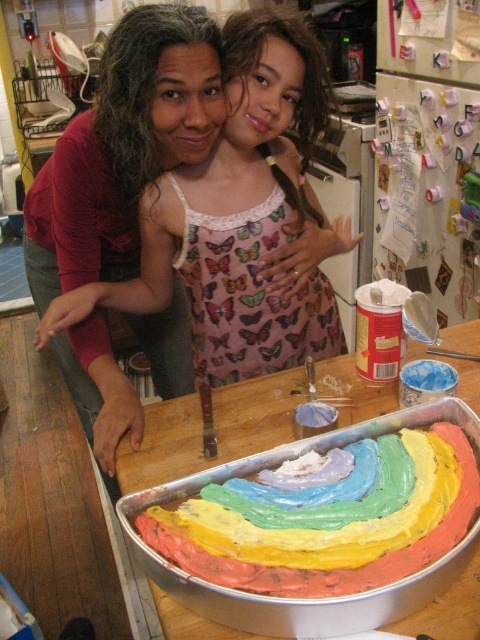
You are a chef who needs to place a cake mold on the baking pan. The mold requires a flat surface free of any decorations. Based on the coordinates provided, is the point at location (135, 179) suitable for placing the mold?

The point at (135, 179) is on butterfly patterned fabric at center, so it is not suitable for placing the mold as it is not on the baking pan.